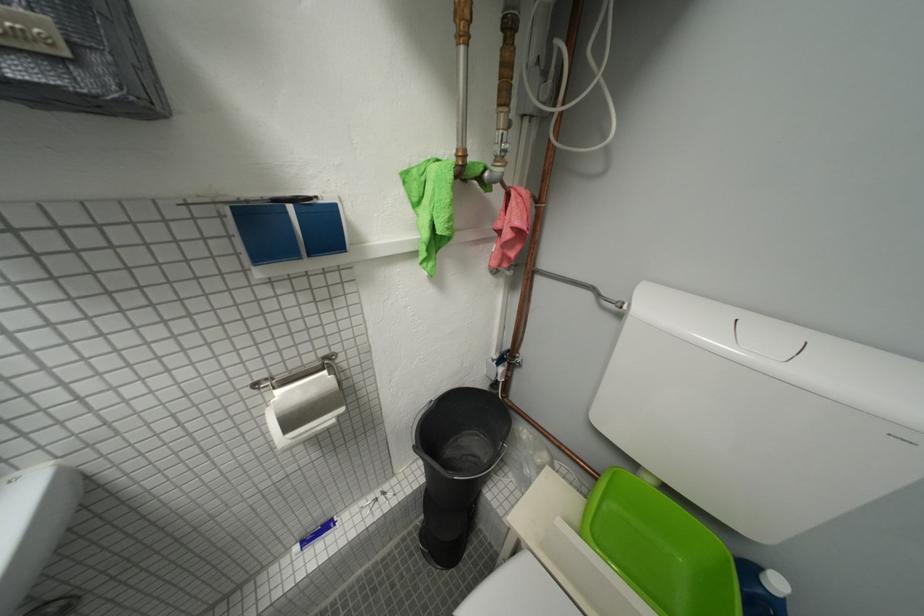
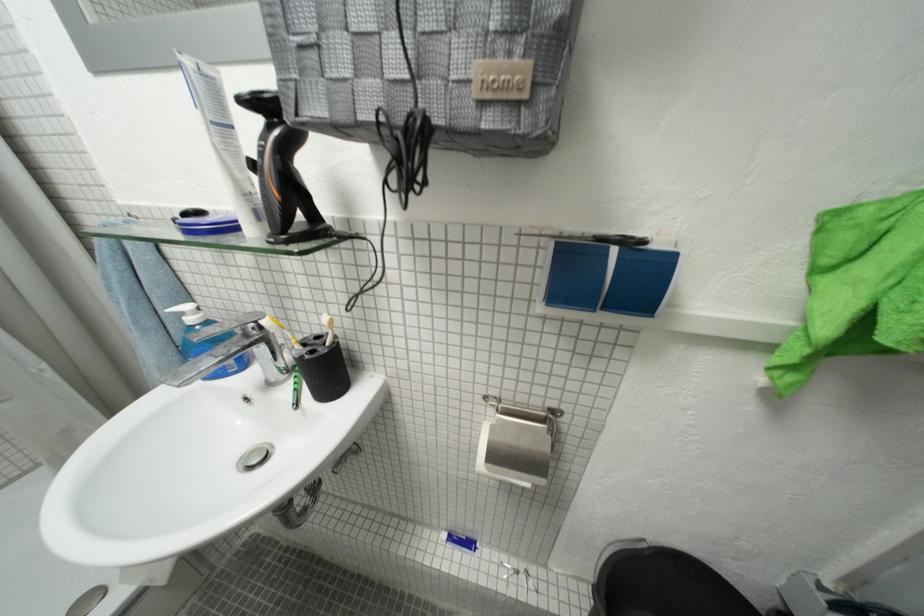
Find the pixel in the second image that matches (x=75, y=55) in the first image.

(535, 98)